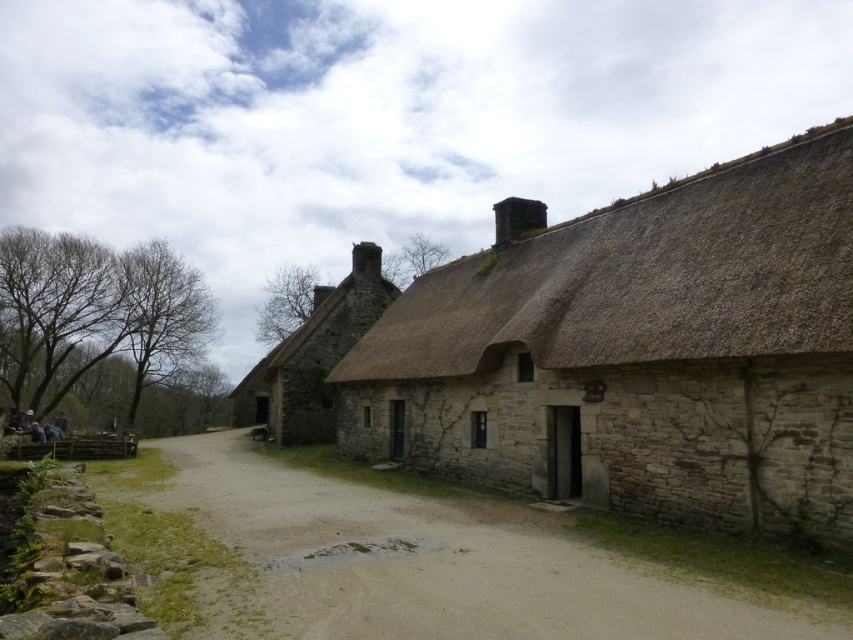
Question: Observing the image, what is the correct spatial positioning of brown thatch roof at upper right in reference to stone thatched cottage at center?

Choices:
 (A) below
 (B) above

Answer: (B)

Question: Does brown thatch roof at upper right appear on the left side of stone thatched cottage at center?

Choices:
 (A) no
 (B) yes

Answer: (A)

Question: Considering the relative positions of brown thatch roof at upper right and stone thatched cottage at center in the image provided, where is brown thatch roof at upper right located with respect to stone thatched cottage at center?

Choices:
 (A) right
 (B) left

Answer: (A)